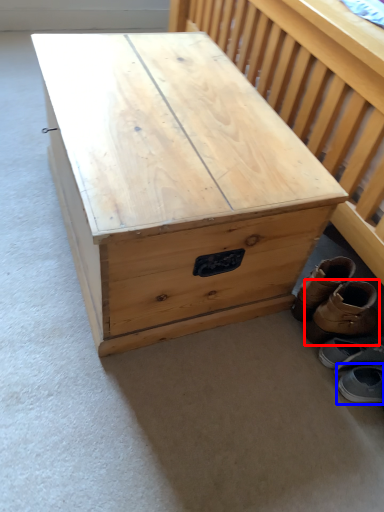
Question: Among these objects, which one is farthest to the camera, footwear (highlighted by a red box) or footwear (highlighted by a blue box)?

Choices:
 (A) footwear
 (B) footwear

Answer: (A)